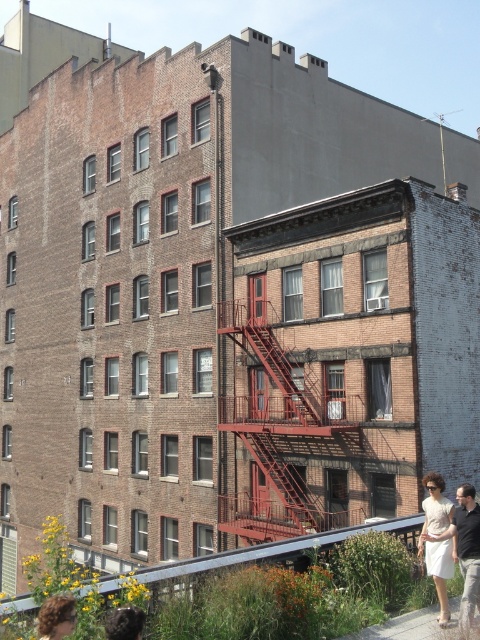
Question: Can you confirm if white cotton dress at lower right is wider than blonde hair at lower left?

Choices:
 (A) yes
 (B) no

Answer: (B)

Question: Can you confirm if rusty metal fire escape at center is positioned to the right of blonde hair at lower left?

Choices:
 (A) no
 (B) yes

Answer: (B)

Question: Does white cotton dress at lower right appear on the right side of blonde hair at lower left?

Choices:
 (A) yes
 (B) no

Answer: (A)

Question: Which is nearer to the blonde hair at lower left?

Choices:
 (A) white cotton dress at lower right
 (B) rusty metal fire escape at center

Answer: (A)

Question: Which is nearer to the white cotton dress at lower right?

Choices:
 (A) blonde hair at lower left
 (B) rusty metal fire escape at center

Answer: (A)

Question: Which point is farther to the camera?

Choices:
 (A) click(x=460, y=525)
 (B) click(x=252, y=400)
 (C) click(x=72, y=611)

Answer: (B)